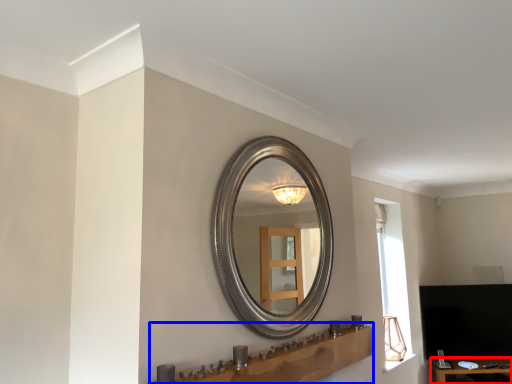
Question: Which object appears closest to the camera in this image, table (highlighted by a red box) or vanity (highlighted by a blue box)?

Choices:
 (A) table
 (B) vanity

Answer: (B)